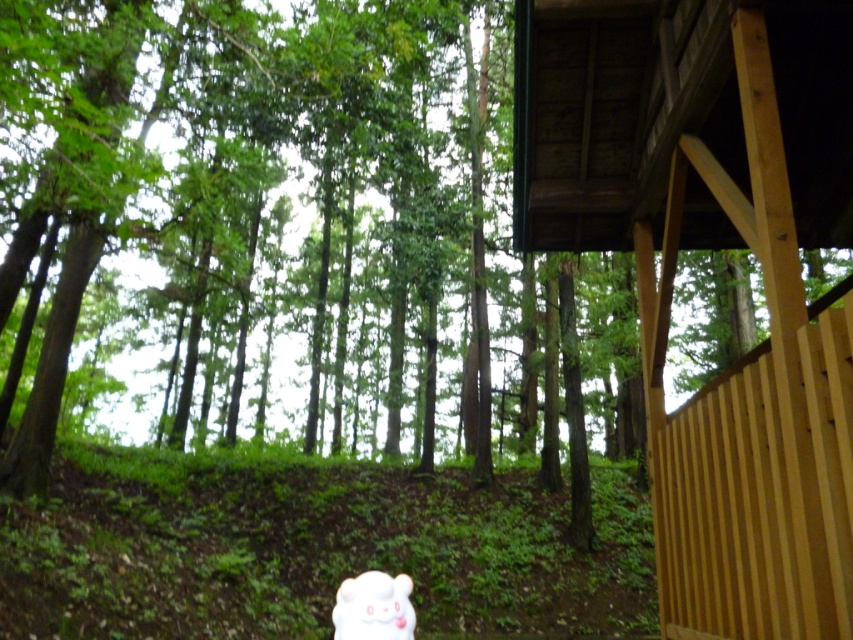
Question: Does wooden cabin at upper right have a greater width compared to white plush toy at lower center?

Choices:
 (A) yes
 (B) no

Answer: (A)

Question: Does wooden cabin at upper right appear over white plush toy at lower center?

Choices:
 (A) yes
 (B) no

Answer: (A)

Question: Which object is farther from the camera taking this photo?

Choices:
 (A) white plush toy at lower center
 (B) wooden cabin at upper right

Answer: (A)

Question: Can you confirm if wooden cabin at upper right is bigger than white plush toy at lower center?

Choices:
 (A) no
 (B) yes

Answer: (B)

Question: Which of the following is the farthest from the observer?

Choices:
 (A) wooden cabin at upper right
 (B) white plush toy at lower center

Answer: (B)